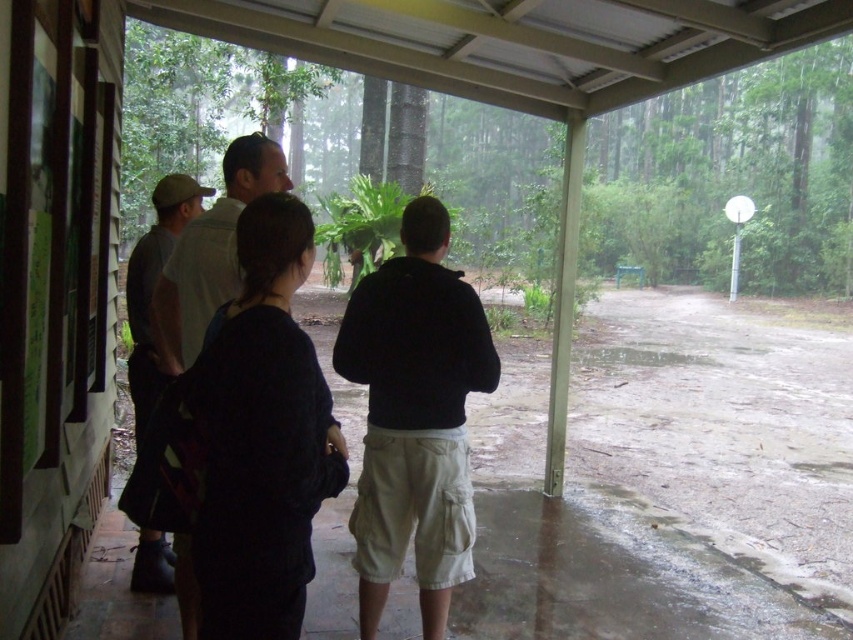
Which of these two, black cotton hoodie at center or dark gray shirt at center, stands taller?

black cotton hoodie at center is taller.

What do you see at coordinates (415, 417) in the screenshot?
I see `black cotton hoodie at center` at bounding box center [415, 417].

Locate an element on the screen. black cotton hoodie at center is located at coordinates (415, 417).